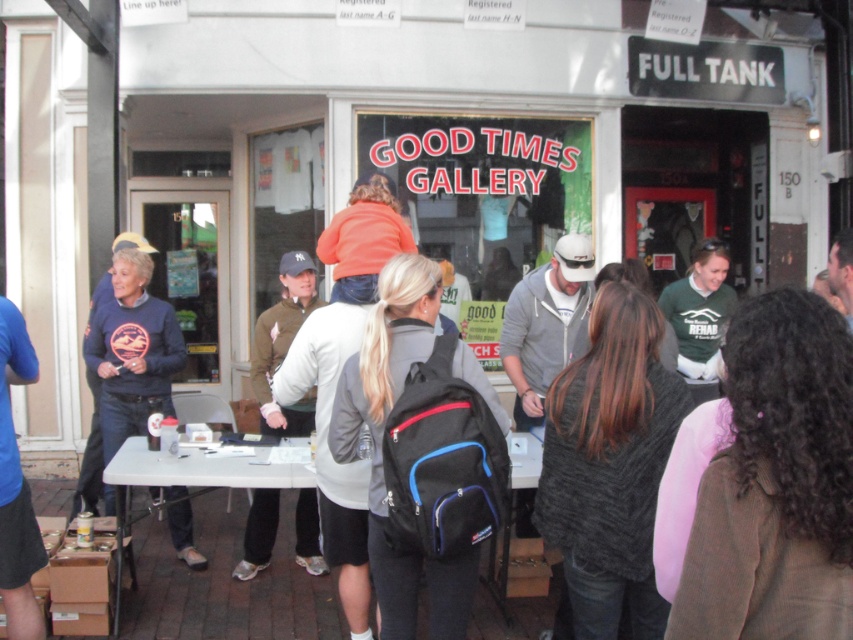
Between navy blue sweater at left and white plastic table at center, which one is positioned higher?

navy blue sweater at left is above.

Between navy blue sweater at left and white plastic table at center, which one has more height?

navy blue sweater at left

Does point (183, 532) come behind point (520, 452)?

Yes, point (183, 532) is farther from viewer.

Locate an element on the screen. The height and width of the screenshot is (640, 853). navy blue sweater at left is located at coordinates (132, 349).

Does khaki cotton jacket at center have a lesser width compared to white plastic table at center?

Yes.

At what (x,y) coordinates should I click in order to perform the action: click on khaki cotton jacket at center. Please return your answer as a coordinate pair (x, y). The image size is (853, 640). Looking at the image, I should click on [x=283, y=344].

At what (x,y) coordinates should I click in order to perform the action: click on khaki cotton jacket at center. Please return your answer as a coordinate pair (x, y). The image size is (853, 640). Looking at the image, I should click on (283, 344).

Who is shorter, white plastic table at center or green matte shirt at center?

white plastic table at center is shorter.

Can you confirm if white plastic table at center is wider than green matte shirt at center?

Yes, white plastic table at center is wider than green matte shirt at center.

The image size is (853, 640). What do you see at coordinates (201, 468) in the screenshot? I see `white plastic table at center` at bounding box center [201, 468].

The width and height of the screenshot is (853, 640). In order to click on white plastic table at center in this screenshot , I will do `click(201, 468)`.